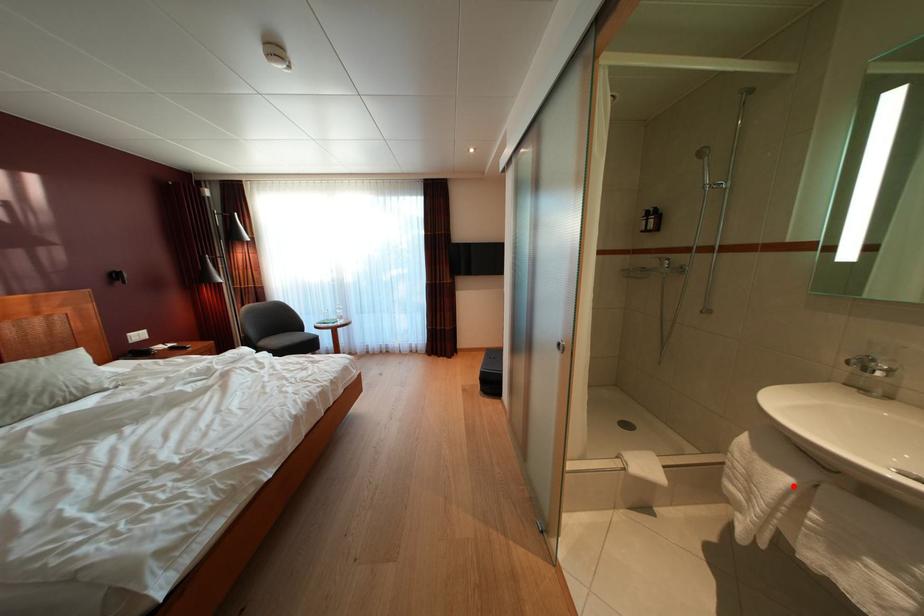
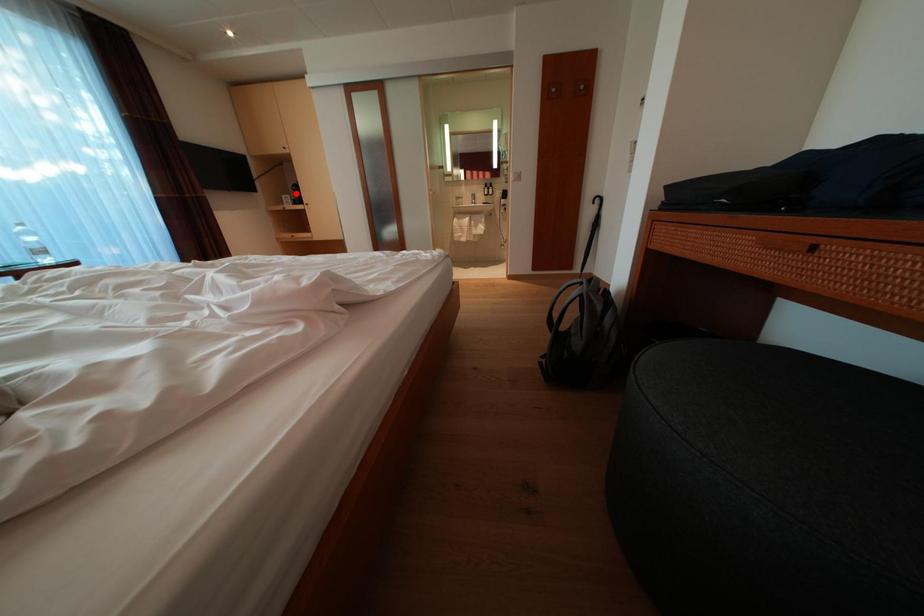
I am providing you with two images of the same scene from different viewpoints. A red point is marked on the first image and another point is marked on the second image. Is the red point in image1 aligned with the point shown in image2?

No